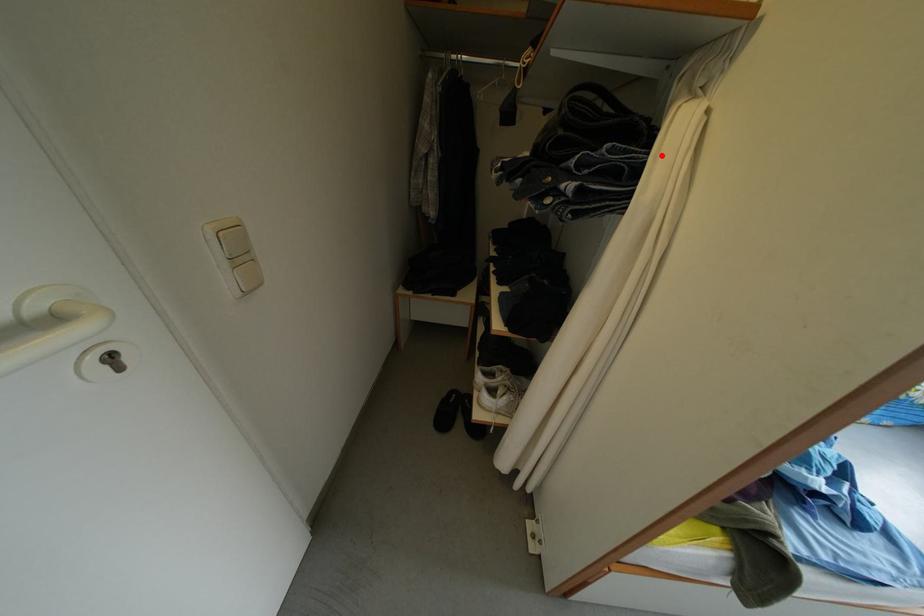
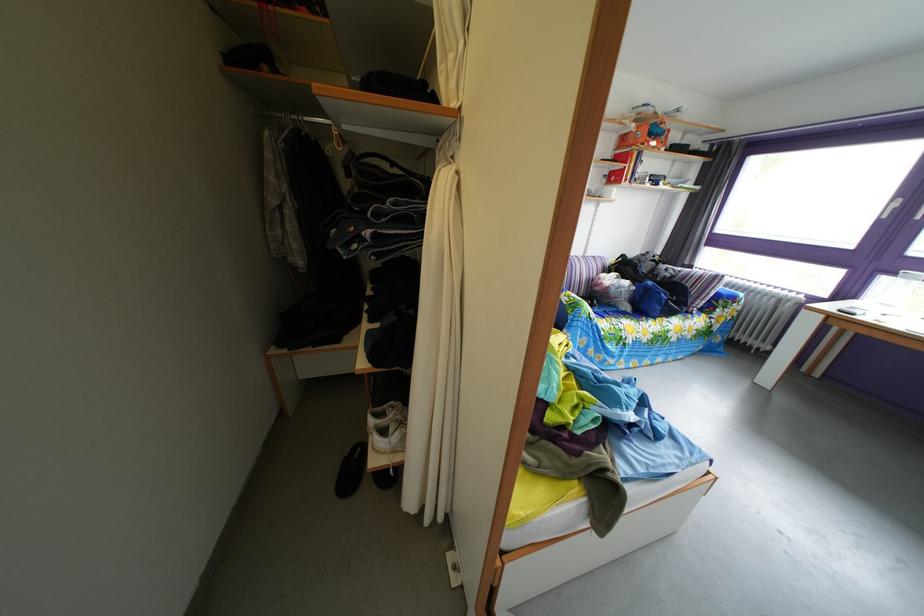
Find the pixel in the second image that matches the highlighted location in the first image.

(438, 207)